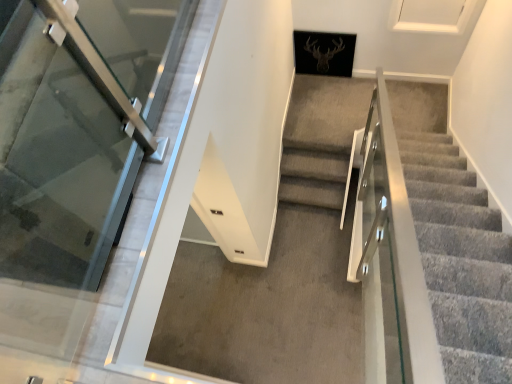
Identify the location of transparent glass door at left. The image size is (512, 384). (72, 160).

The height and width of the screenshot is (384, 512). What do you see at coordinates (72, 160) in the screenshot?
I see `transparent glass door at left` at bounding box center [72, 160].

Where is `transparent glass door at left`? This screenshot has width=512, height=384. transparent glass door at left is located at coordinates (72, 160).